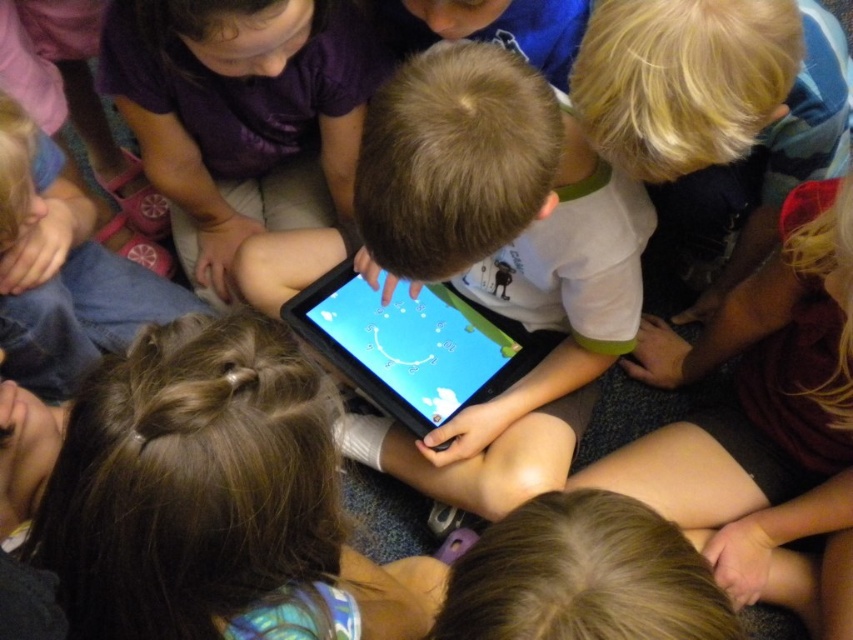
The image size is (853, 640). Identify the location of smooth black tablet at center. (496, 260).

Consider the image. Does smooth black tablet at center appear on the right side of black plastic tablet at center?

Yes, smooth black tablet at center is to the right of black plastic tablet at center.

Is point (567, 136) less distant than point (329, 349)?

That is True.

Find the location of a particular element. Image resolution: width=853 pixels, height=640 pixels. smooth black tablet at center is located at coordinates (496, 260).